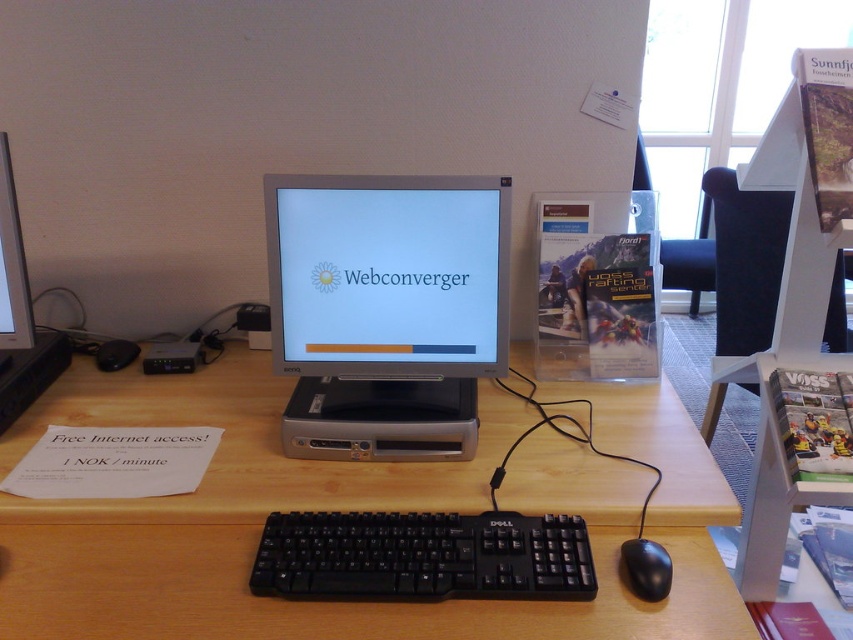
Is black plastic keyboard at center positioned behind matte silver monitor at center?

No, black plastic keyboard at center is in front of matte silver monitor at center.

Can you confirm if black plastic keyboard at center is positioned to the left of matte silver monitor at center?

Incorrect, black plastic keyboard at center is not on the left side of matte silver monitor at center.

Is point (431, 545) positioned behind point (1, 282)?

That is False.

Where is `black plastic keyboard at center`? Image resolution: width=853 pixels, height=640 pixels. black plastic keyboard at center is located at coordinates pyautogui.click(x=422, y=556).

Is satin silver monitor at center closer to camera compared to black matte mouse at lower right?

No, it is not.

Locate an element on the screen. This screenshot has width=853, height=640. satin silver monitor at center is located at coordinates (386, 310).

From the picture: Does satin silver monitor at left have a greater width compared to black matte mouse at lower right?

Indeed, satin silver monitor at left has a greater width compared to black matte mouse at lower right.

Measure the distance between point [10,388] and camera.

Point [10,388] is 1.20 meters from camera.

Between point (12, 202) and point (642, 561), which one is positioned in front?

Point (642, 561) is more forward.

You are a GUI agent. You are given a task and a screenshot of the screen. Output one action in this format:
    pyautogui.click(x=<x>, y=<y>)
    Task: Click on the satin silver monitor at left
    
    Given the screenshot: What is the action you would take?
    pyautogui.click(x=20, y=314)